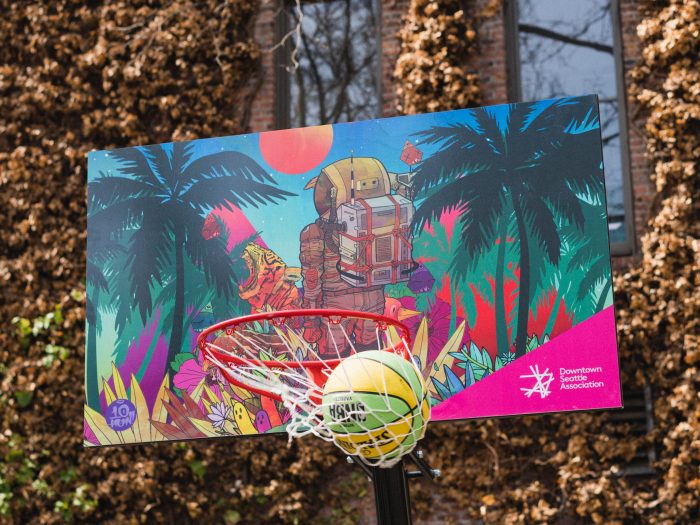
At what (x,y) coordinates should I click in order to perform the action: click on black windows. Please return your answer as a coordinate pair (x, y). The image size is (700, 525). Looking at the image, I should click on (372, 74), (582, 67).